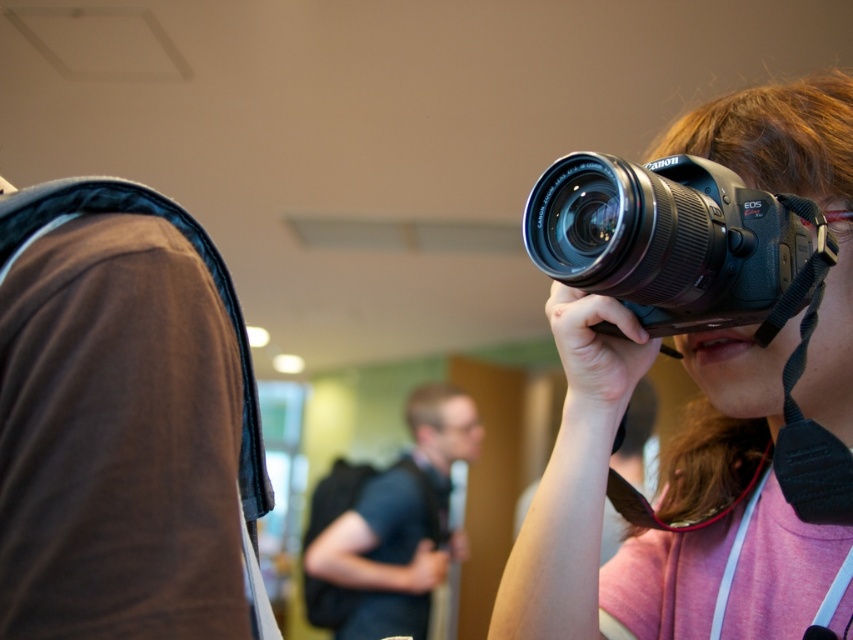
Which is more to the left, black plastic camera at upper right or black matte shirt at center?

black matte shirt at center is more to the left.

Is black plastic camera at upper right positioned at the back of black matte shirt at center?

That is False.

Where is `black plastic camera at upper right`? Image resolution: width=853 pixels, height=640 pixels. black plastic camera at upper right is located at coordinates (672, 241).

Between point (770, 493) and point (432, 458), which one is positioned behind?

The point (432, 458) is more distant.

Who is more forward, [646,624] or [321,544]?

Positioned in front is point [646,624].

Does point (711, 349) come in front of point (434, 490)?

Yes, point (711, 349) is closer to viewer.

The height and width of the screenshot is (640, 853). I want to click on matte black camera at upper right, so click(x=601, y=508).

Who is higher up, matte black camera at upper right or black plastic camera at upper right?

black plastic camera at upper right is above.

Between point (582, 320) and point (766, 232), which one is positioned in front?

Point (766, 232)

Who is more forward, (503, 609) or (579, 256)?

Positioned in front is point (579, 256).

Locate an element on the screen. Image resolution: width=853 pixels, height=640 pixels. matte black camera at upper right is located at coordinates (601, 508).